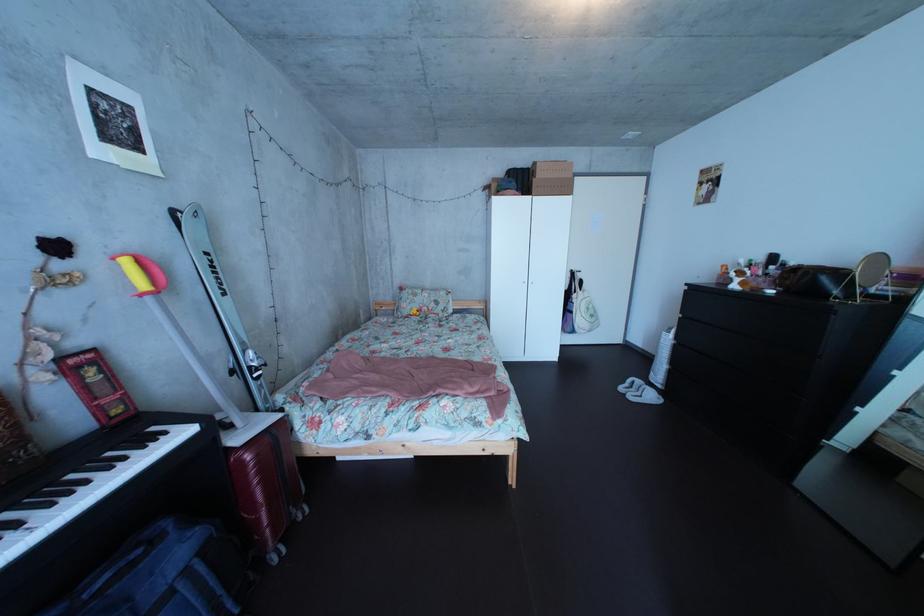
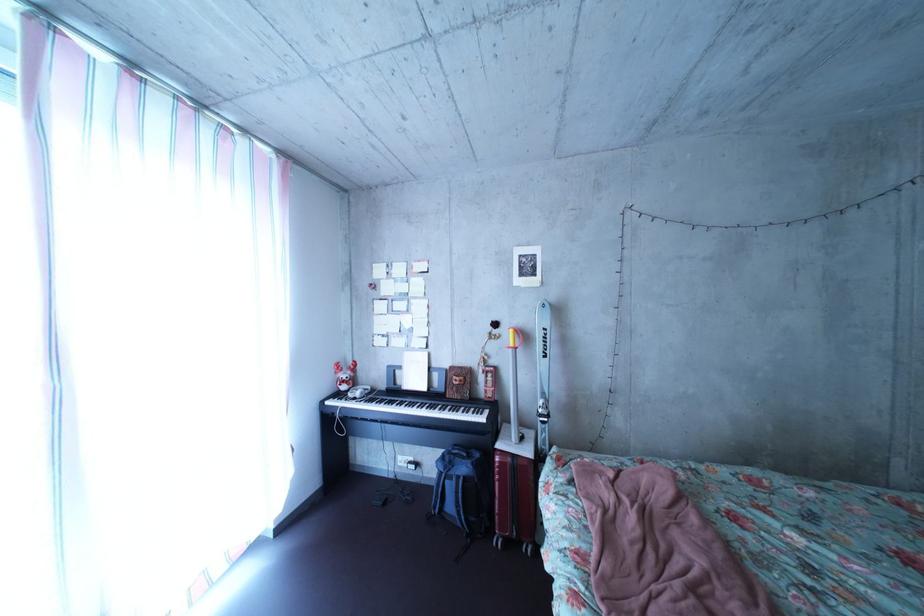
In the second image, find the point that corresponds to point (75, 274) in the first image.

(509, 339)